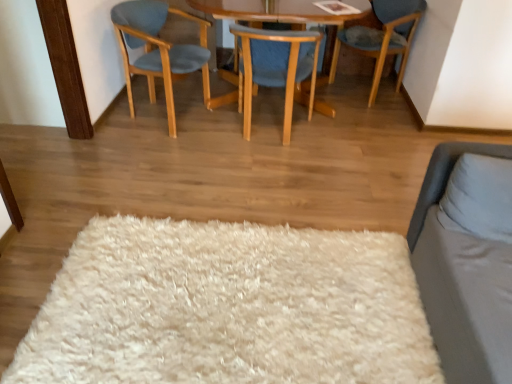
Question: Is wooden chair at center, which ranks as the 2th chair in right-to-left order, placed right next to white fluffy rug at center?

Choices:
 (A) yes
 (B) no

Answer: (B)

Question: Is the position of wooden chair at center, which ranks as the 2th chair in right-to-left order, more distant than that of white fluffy rug at center?

Choices:
 (A) no
 (B) yes

Answer: (B)

Question: Can you confirm if wooden chair at center, marked as the second chair in a left-to-right arrangement, is shorter than white fluffy rug at center?

Choices:
 (A) no
 (B) yes

Answer: (A)

Question: Does wooden chair at center, marked as the second chair in a left-to-right arrangement, have a greater width compared to white fluffy rug at center?

Choices:
 (A) no
 (B) yes

Answer: (A)

Question: Considering the relative sizes of wooden chair at center, which ranks as the 2th chair in right-to-left order, and white fluffy rug at center in the image provided, is wooden chair at center, which ranks as the 2th chair in right-to-left order, smaller than white fluffy rug at center?

Choices:
 (A) yes
 (B) no

Answer: (B)

Question: Can you confirm if wooden chair at center, which ranks as the 2th chair in right-to-left order, is positioned to the right of white fluffy rug at center?

Choices:
 (A) no
 (B) yes

Answer: (B)

Question: Is blue fabric chair at upper right, which is counted as the first chair, starting from the right, directly adjacent to light blue fabric chair at left, which is the 3th chair from right to left?

Choices:
 (A) no
 (B) yes

Answer: (A)

Question: Considering the relative sizes of blue fabric chair at upper right, the third chair positioned from the left, and light blue fabric chair at left, marked as the 1th chair in a left-to-right arrangement, in the image provided, is blue fabric chair at upper right, the third chair positioned from the left, taller than light blue fabric chair at left, marked as the 1th chair in a left-to-right arrangement,?

Choices:
 (A) no
 (B) yes

Answer: (A)

Question: Is blue fabric chair at upper right, which is counted as the first chair, starting from the right, to the right of light blue fabric chair at left, marked as the 1th chair in a left-to-right arrangement, from the viewer's perspective?

Choices:
 (A) no
 (B) yes

Answer: (B)

Question: Can you confirm if blue fabric chair at upper right, the third chair positioned from the left, is bigger than light blue fabric chair at left, marked as the 1th chair in a left-to-right arrangement?

Choices:
 (A) yes
 (B) no

Answer: (A)

Question: From a real-world perspective, does blue fabric chair at upper right, the third chair positioned from the left, sit lower than light blue fabric chair at left, marked as the 1th chair in a left-to-right arrangement?

Choices:
 (A) no
 (B) yes

Answer: (A)

Question: Considering the relative sizes of blue fabric chair at upper right, which is counted as the first chair, starting from the right, and light blue fabric chair at left, marked as the 1th chair in a left-to-right arrangement, in the image provided, is blue fabric chair at upper right, which is counted as the first chair, starting from the right, wider than light blue fabric chair at left, marked as the 1th chair in a left-to-right arrangement,?

Choices:
 (A) yes
 (B) no

Answer: (A)